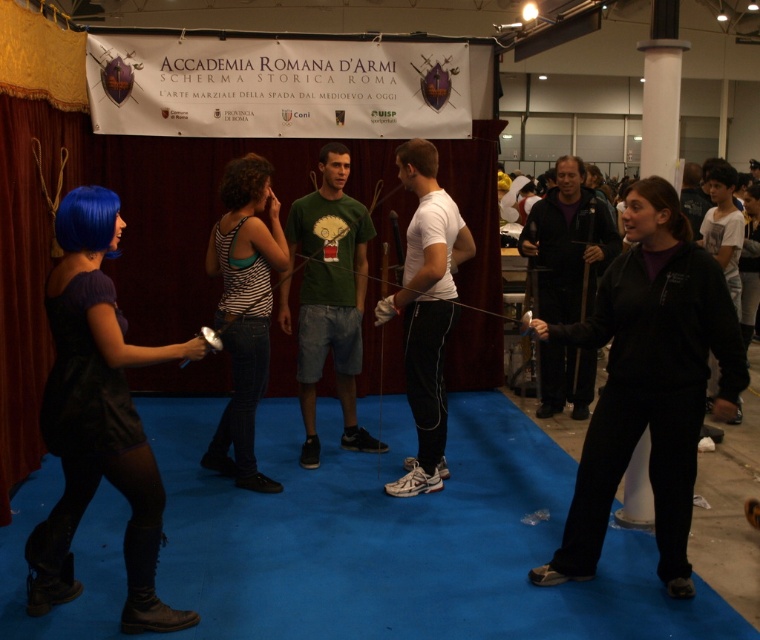
Question: Is white matte t-shirt at center to the left of dark gray fabric jacket at right from the viewer's perspective?

Choices:
 (A) no
 (B) yes

Answer: (B)

Question: Which of the following is the farthest from the observer?

Choices:
 (A) green cotton t-shirt at center
 (B) white matte t-shirt at center

Answer: (A)

Question: Considering the real-world distances, which object is closest to the white matte t-shirt at center?

Choices:
 (A) green cotton t-shirt at center
 (B) dark gray fabric jacket at right

Answer: (A)

Question: Is green cotton t-shirt at center bigger than white matte t-shirt at center?

Choices:
 (A) no
 (B) yes

Answer: (B)

Question: Which object is the farthest from the green cotton t-shirt at center?

Choices:
 (A) white matte t-shirt at center
 (B) dark gray fabric jacket at right

Answer: (B)

Question: Is green cotton t-shirt at center to the right of white matte t-shirt at center from the viewer's perspective?

Choices:
 (A) yes
 (B) no

Answer: (B)